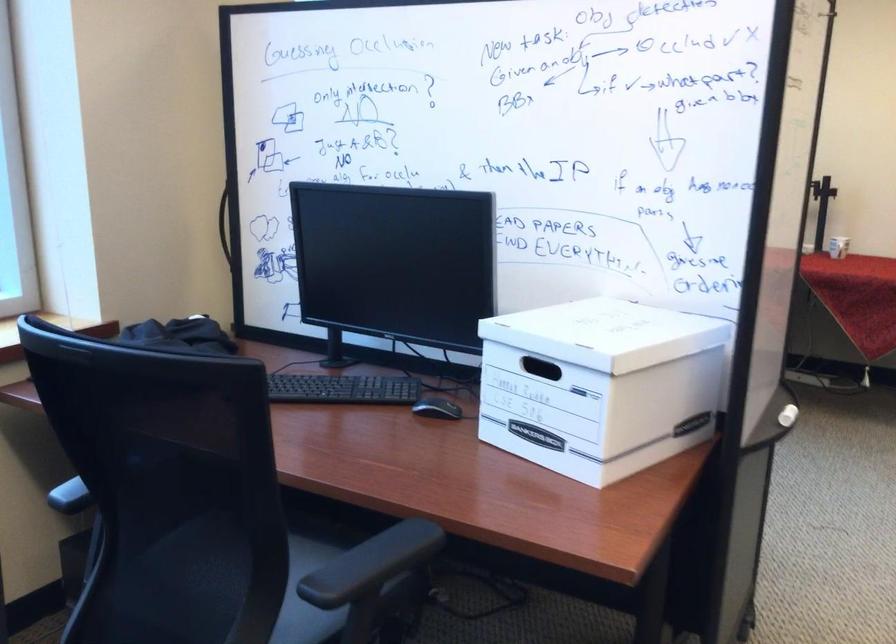
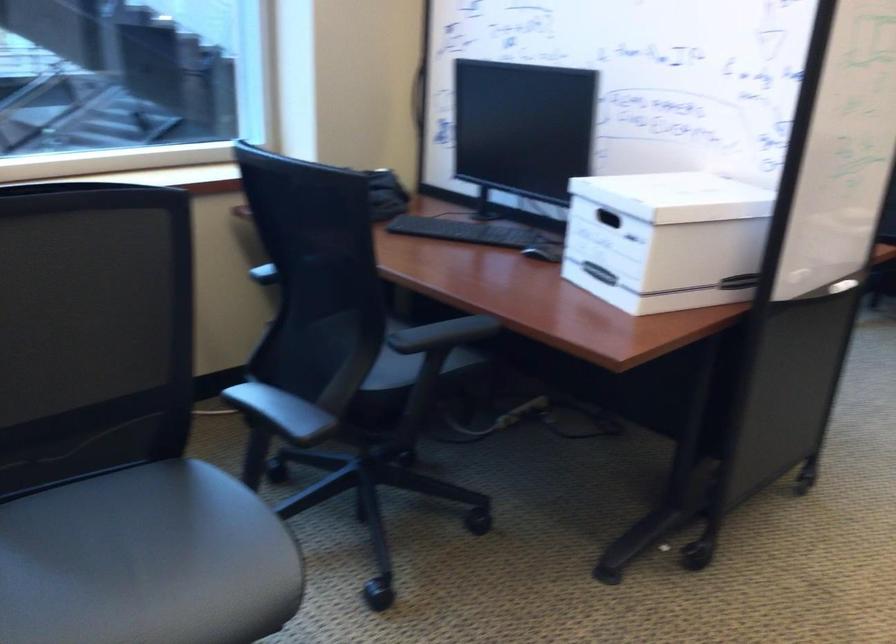
Find the pixel in the second image that matches (x=329, y=391) in the first image.

(467, 231)